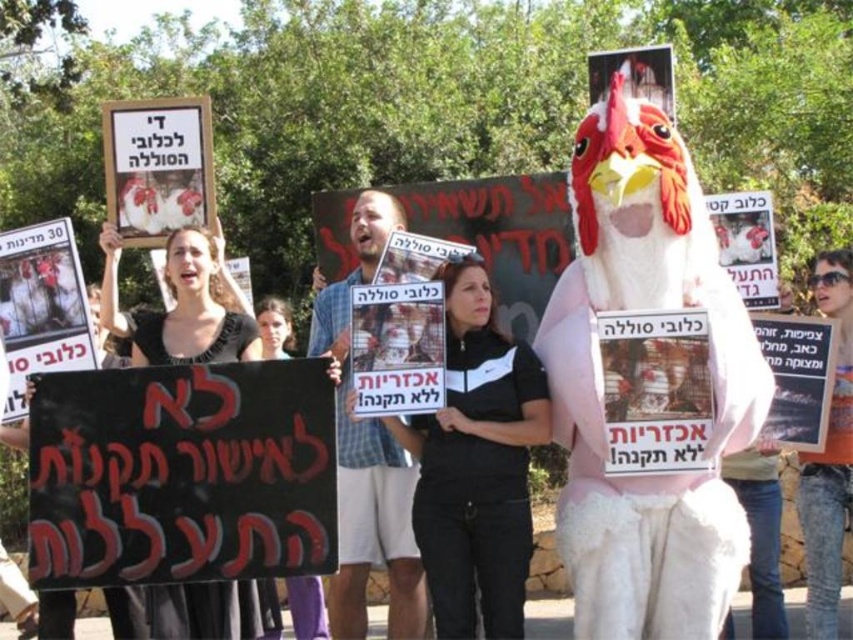
Question: Is the position of black fabric shirt at center less distant than that of plaid shirt at center?

Choices:
 (A) yes
 (B) no

Answer: (B)

Question: Among these objects, which one is nearest to the camera?

Choices:
 (A) black fabric shirt at center
 (B) orange t-shirt at center
 (C) black fabric at center
 (D) plaid shirt at center

Answer: (C)

Question: Among these objects, which one is nearest to the camera?

Choices:
 (A) black fabric at center
 (B) black fabric shirt at center

Answer: (A)

Question: Can you confirm if black fabric shirt at center is wider than black fabric at center?

Choices:
 (A) yes
 (B) no

Answer: (B)

Question: Can you confirm if plaid shirt at center is positioned to the right of black fabric at center?

Choices:
 (A) yes
 (B) no

Answer: (A)

Question: Which point is closer to the camera?

Choices:
 (A) orange t-shirt at center
 (B) black fabric at center
 (C) black fabric shirt at center
 (D) plaid shirt at center

Answer: (B)